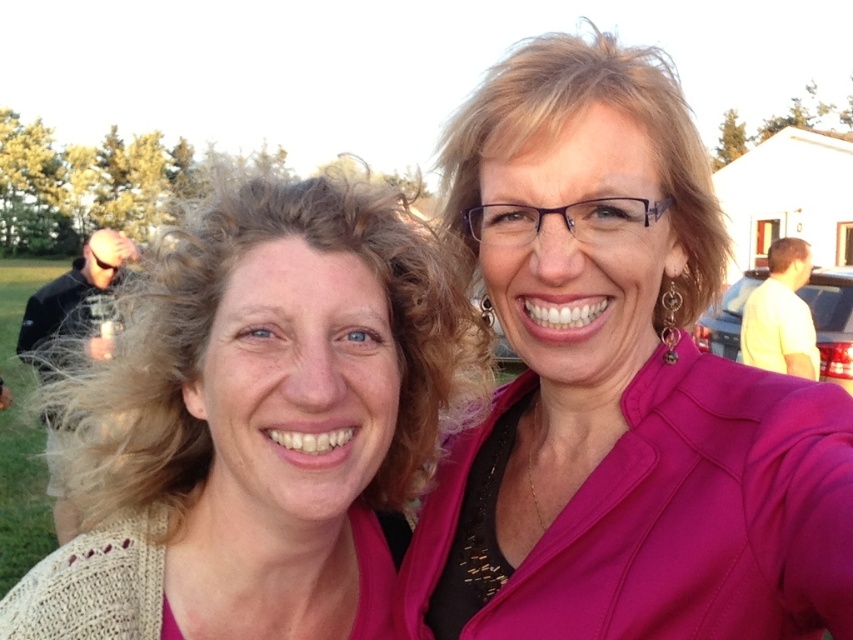
Who is lower down, pink matte blazer at upper right or knitted beige sweater at left?

knitted beige sweater at left is below.

Is pink matte blazer at upper right below knitted beige sweater at left?

No, pink matte blazer at upper right is not below knitted beige sweater at left.

This screenshot has height=640, width=853. Find the location of `pink matte blazer at upper right`. pink matte blazer at upper right is located at coordinates (618, 388).